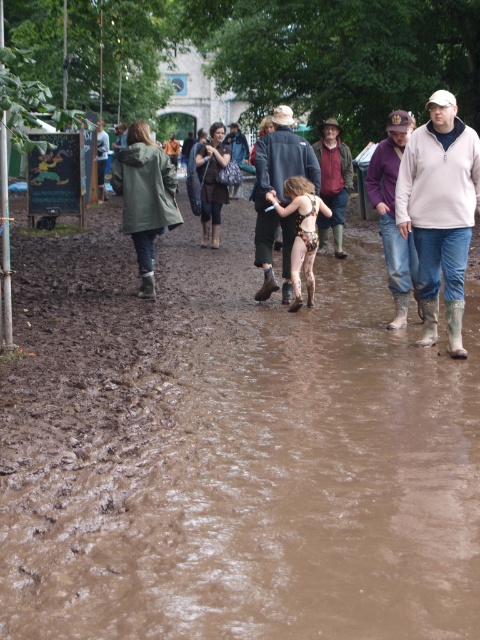
You are trying to cross the brown muddy path at center while avoiding getting your matte black jacket at center dirty. Based on the scene, which direction should you move to keep the jacket clean?

The brown muddy path at center is in front of matte black jacket at center, so to keep the matte black jacket at center clean, you should move to the sides of the path away from the muddy area in front.

You are standing at the edge of the brown muddy path at center. You need to walk to the other side of the path, which is 2.85 meters away. If your walking speed is 1.5 meters per second, how many seconds will it take you to cross the path safely?

The brown muddy path at center is 2.85 meters away from the viewer. To cross it at a speed of 1.5 meters per second, the time required would be distance divided by speed, so 2.85 divided by 1.5 equals approximately 1.9 seconds. Therefore, it will take roughly 1.9 seconds to cross the path safely.